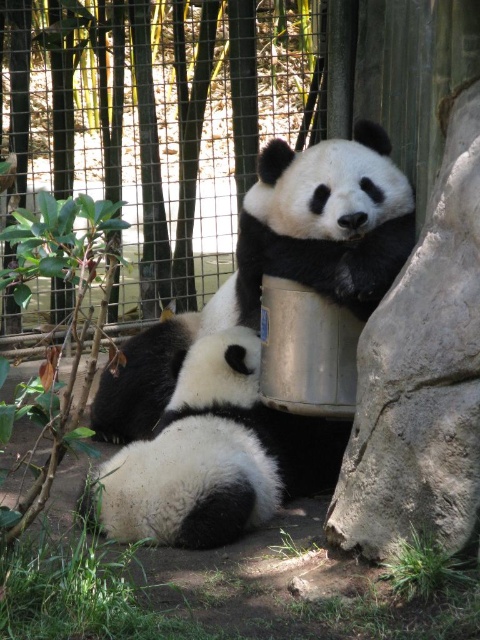
Question: Which point appears farthest from the camera in this image?

Choices:
 (A) (286, 112)
 (B) (347, 227)
 (C) (406, 186)

Answer: (A)

Question: From the image, what is the correct spatial relationship of black matte panda at center in relation to white soft fur panda at center?

Choices:
 (A) below
 (B) above

Answer: (B)

Question: Considering the real-world distances, which object is closest to the black matte panda at center?

Choices:
 (A) white soft fur panda at center
 (B) black fuzzy panda at center
 (C) gray rough stone at right
 (D) brushed metal fence at upper center

Answer: (B)

Question: Is gray rough stone at right further to camera compared to black matte panda at center?

Choices:
 (A) no
 (B) yes

Answer: (A)

Question: Is brushed metal fence at upper center in front of white soft fur panda at center?

Choices:
 (A) yes
 (B) no

Answer: (B)

Question: Which object is the farthest from the black matte panda at center?

Choices:
 (A) gray rough stone at right
 (B) black fuzzy panda at center

Answer: (A)